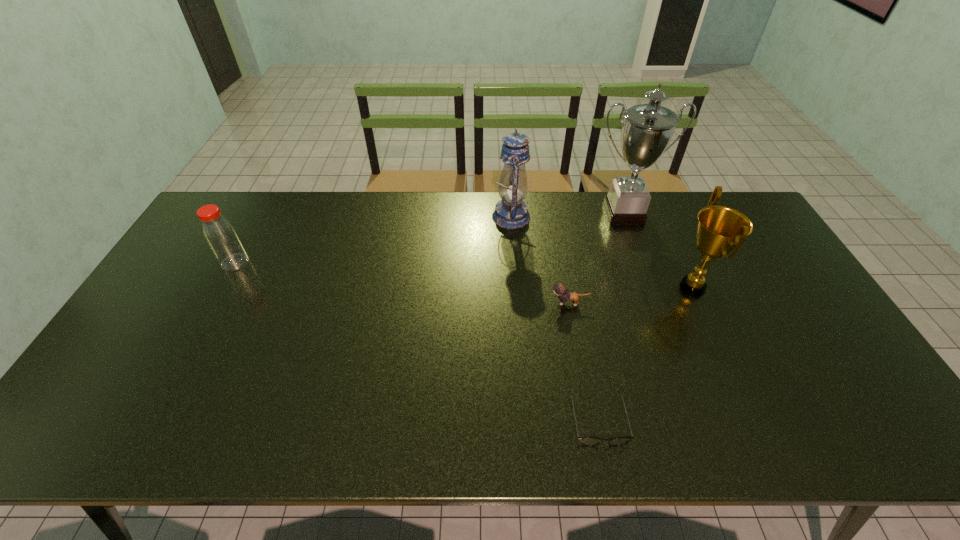
The height and width of the screenshot is (540, 960). In order to click on vacant point located between the shortest object and the second object from left to right in this screenshot , I will do `click(554, 318)`.

Identify the location of vacant space that is in between the leftmost object and the second shortest object. (402, 283).

Find the location of a particular element. Image resolution: width=960 pixels, height=540 pixels. vacant area between the kitten and the bottle is located at coordinates (402, 283).

This screenshot has height=540, width=960. Find the location of `free space between the bottle and the trophy cup`. free space between the bottle and the trophy cup is located at coordinates (429, 238).

The height and width of the screenshot is (540, 960). Identify the location of vacant area that lies between the bottle and the award. (464, 275).

The height and width of the screenshot is (540, 960). In order to click on free space between the nearest object and the award in this screenshot , I will do `click(645, 353)`.

You are a GUI agent. You are given a task and a screenshot of the screen. Output one action in this format:
    pyautogui.click(x=<x>, y=<y>)
    Task: Click on the vacant space in between the tallest object and the second shortest object
    
    Given the screenshot: What is the action you would take?
    pyautogui.click(x=596, y=258)

Image resolution: width=960 pixels, height=540 pixels. What are the coordinates of `vacant point located between the trophy cup and the nearest object` in the screenshot? It's located at (611, 316).

Choose which object is the fifth nearest neighbor to the shortest object. Please provide its 2D coordinates. Your answer should be formatted as a tuple, i.e. [(x, y)], where the tuple contains the x and y coordinates of a point satisfying the conditions above.

[(219, 233)]

Locate an element on the screen. The height and width of the screenshot is (540, 960). the third closest object to the kitten is located at coordinates (511, 212).